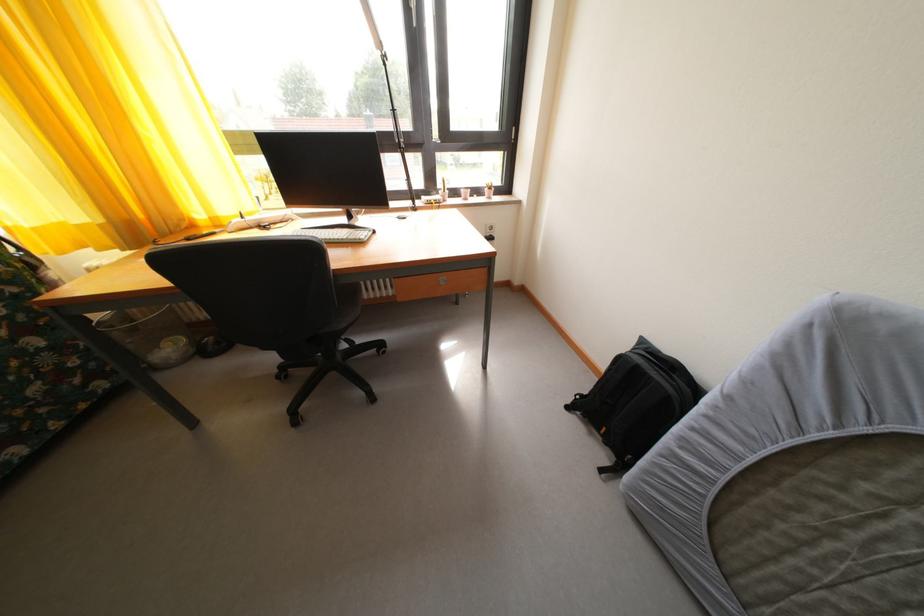
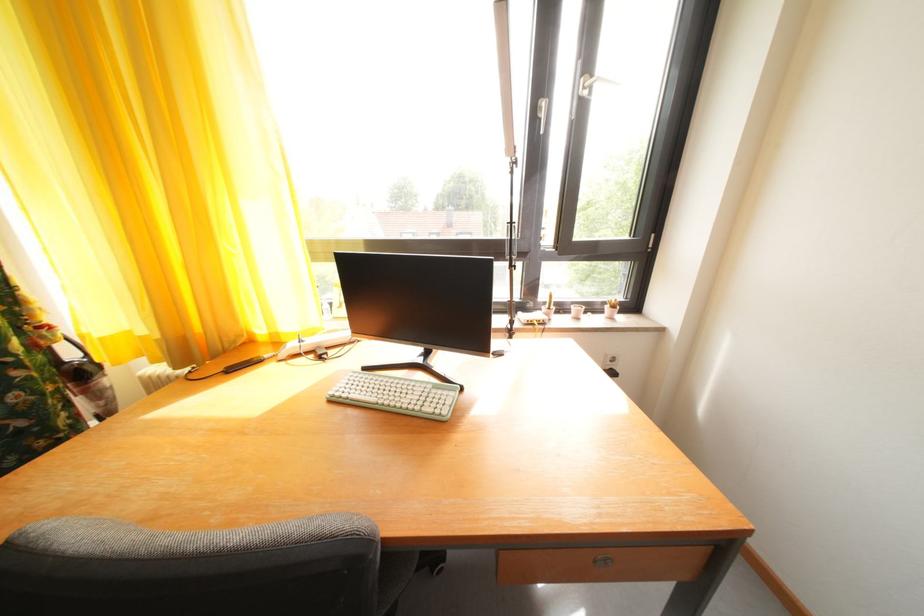
Question: How did the camera likely rotate?

Choices:
 (A) Left
 (B) Right
 (C) Up
 (D) Down

Answer: (C)